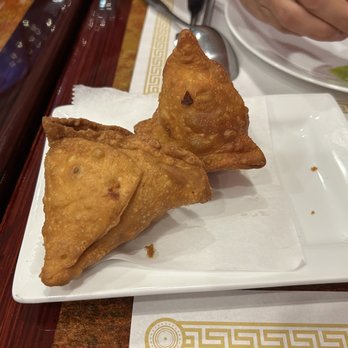
You are a GUI agent. You are given a task and a screenshot of the screen. Output one action in this format:
    pyautogui.click(x=<x>, y=<y>)
    Task: Click on the round plate
    
    Given the screenshot: What is the action you would take?
    pyautogui.click(x=287, y=62)